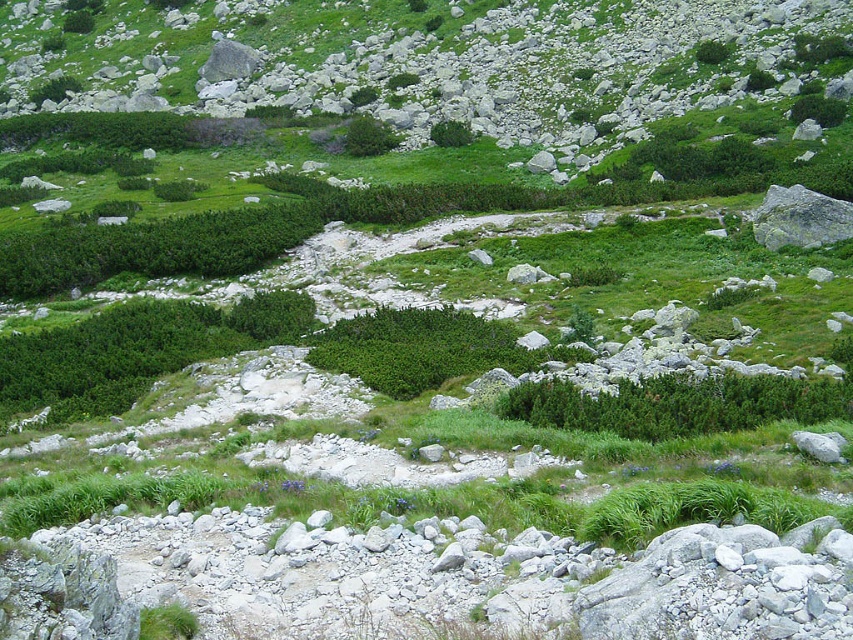
You are a hiker trying to navigate through the mountainous terrain. You notice two plants in the center of your path. Which one is larger between the green matte shrub at center and the green leafy bush at center?

The green matte shrub at center is bigger than the green leafy bush at center, so the green matte shrub at center is larger.

You are a hiker who wants to place a marker at the exact center of the image. You see the point marked at coordinates point (677,404). Is the marker already placed at the center?

The point (677,404) marks green matte shrub at center, so the marker is already placed at the center.

You are standing in the mountainous terrain and notice two plants at the center of the scene. Which one is nearer to you, the green matte shrub at center or the green leafy bush at center?

The green matte shrub at center is closer to the viewer than the green leafy bush at center.